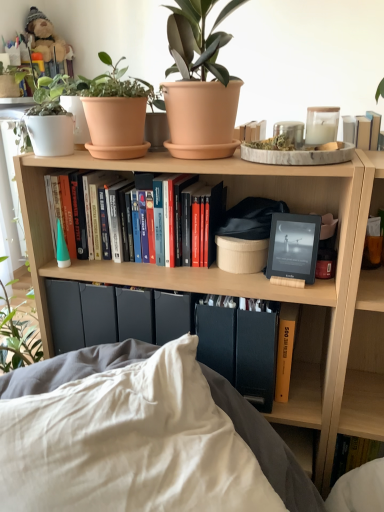
Question: Would you say terracotta pot at upper center is outside matte black e-reader at center?

Choices:
 (A) no
 (B) yes

Answer: (B)

Question: Is terracotta pot at upper center aimed at matte black e-reader at center?

Choices:
 (A) yes
 (B) no

Answer: (B)

Question: Considering the relative sizes of terracotta pot at upper center and matte black e-reader at center in the image provided, is terracotta pot at upper center taller than matte black e-reader at center?

Choices:
 (A) yes
 (B) no

Answer: (A)

Question: Is matte black e-reader at center located within terracotta pot at upper center?

Choices:
 (A) no
 (B) yes

Answer: (A)

Question: From the image's perspective, is terracotta pot at upper center over matte black e-reader at center?

Choices:
 (A) yes
 (B) no

Answer: (A)

Question: From their relative heights in the image, would you say terracotta pot at upper center is taller or shorter than white soft pillow at lower center?

Choices:
 (A) short
 (B) tall

Answer: (A)

Question: Do you think terracotta pot at upper center is within white soft pillow at lower center, or outside of it?

Choices:
 (A) inside
 (B) outside

Answer: (B)

Question: Is terracotta pot at upper center bigger or smaller than white soft pillow at lower center?

Choices:
 (A) small
 (B) big

Answer: (A)

Question: Is point click(198, 98) closer or farther from the camera than point click(238, 503)?

Choices:
 (A) farther
 (B) closer

Answer: (A)

Question: Considering their positions, is wooden bookshelf at center located in front of or behind hardcover books at center, placed as the first book when sorted from left to right?

Choices:
 (A) front
 (B) behind

Answer: (A)

Question: Looking at the image, does wooden bookshelf at center seem bigger or smaller compared to hardcover books at center, placed as the first book when sorted from left to right?

Choices:
 (A) big
 (B) small

Answer: (A)

Question: In terms of height, does wooden bookshelf at center look taller or shorter compared to hardcover books at center, placed as the first book when sorted from left to right?

Choices:
 (A) short
 (B) tall

Answer: (B)

Question: Considering the positions of point (332, 368) and point (152, 189), is point (332, 368) closer or farther from the camera than point (152, 189)?

Choices:
 (A) farther
 (B) closer

Answer: (B)

Question: Is white soft pillow at lower center bigger or smaller than terracotta pot at upper center?

Choices:
 (A) big
 (B) small

Answer: (A)

Question: From the image's perspective, is white soft pillow at lower center above or below terracotta pot at upper center?

Choices:
 (A) below
 (B) above

Answer: (A)